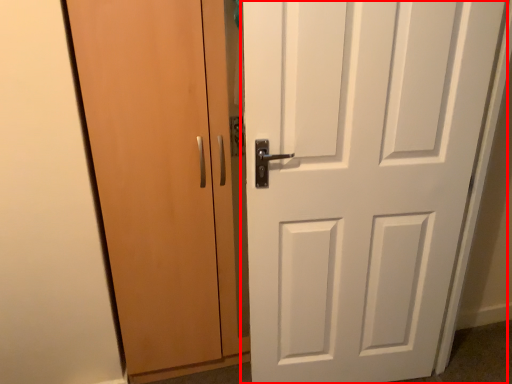
Question: From the image, what is the correct spatial relationship of door (annotated by the red box) in relation to door?

Choices:
 (A) left
 (B) right

Answer: (B)